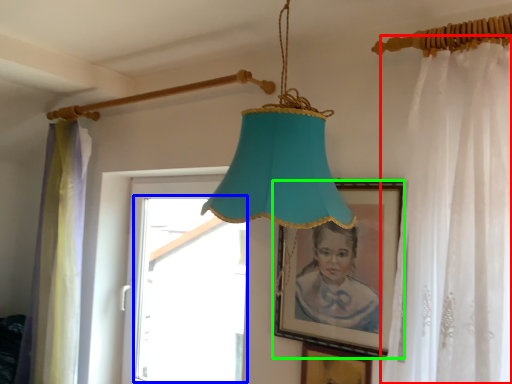
Question: Considering the real-world distances, which object is farthest from curtain (highlighted by a red box)? window (highlighted by a blue box) or picture frame (highlighted by a green box)?

Choices:
 (A) window
 (B) picture frame

Answer: (A)